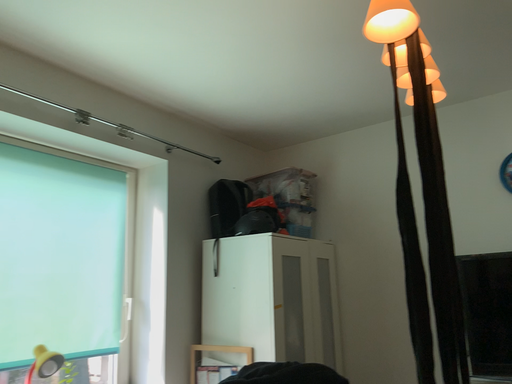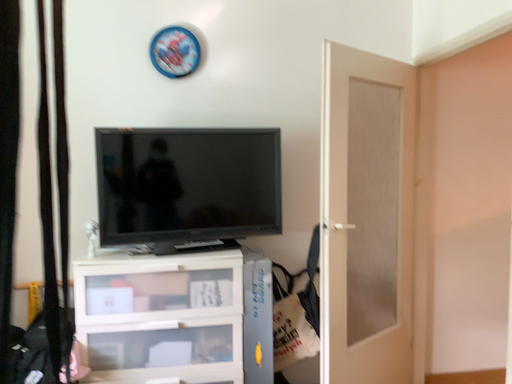
Question: How did the camera likely rotate when shooting the video?

Choices:
 (A) rotated upward
 (B) rotated downward

Answer: (B)